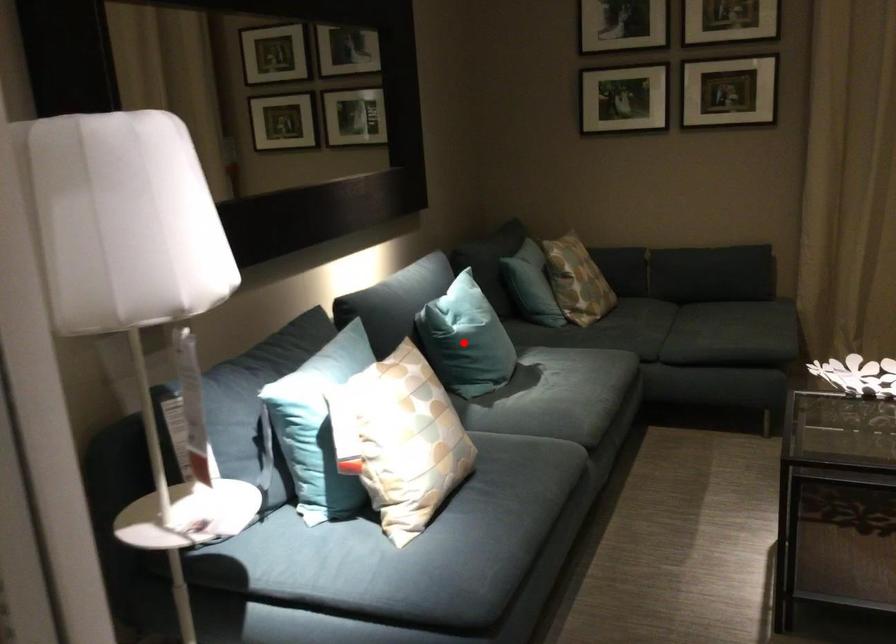
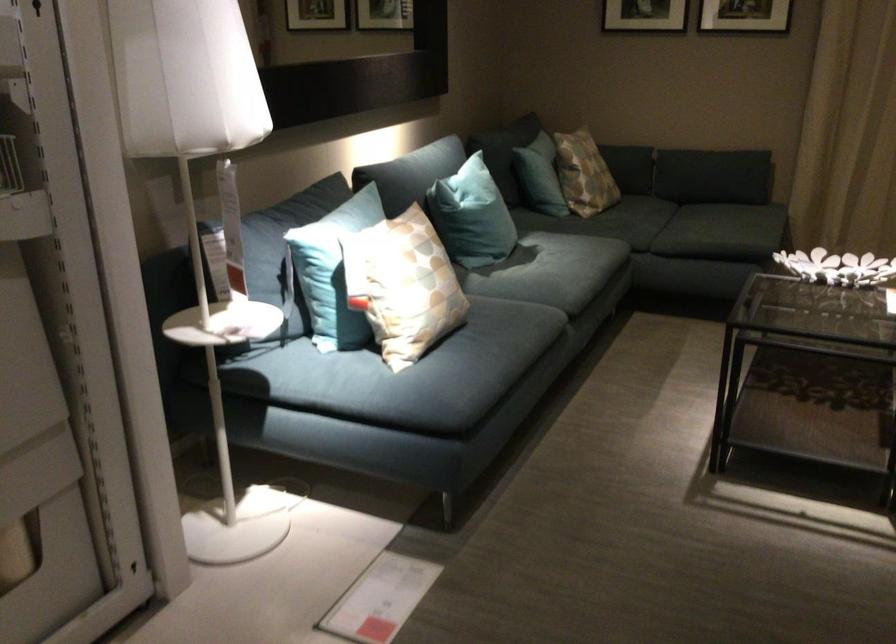
Find the pixel in the second image that matches the highlighted location in the first image.

(471, 216)